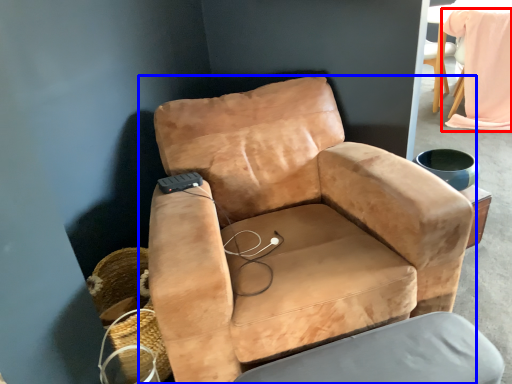
Question: Which of the following is the farthest to the observer, bean bag chair (highlighted by a red box) or chair (highlighted by a blue box)?

Choices:
 (A) bean bag chair
 (B) chair

Answer: (A)